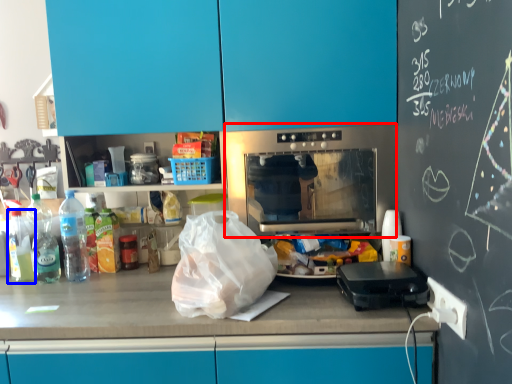
Question: Which object is further to the camera taking this photo, home appliance (highlighted by a red box) or bottle (highlighted by a blue box)?

Choices:
 (A) home appliance
 (B) bottle

Answer: (B)